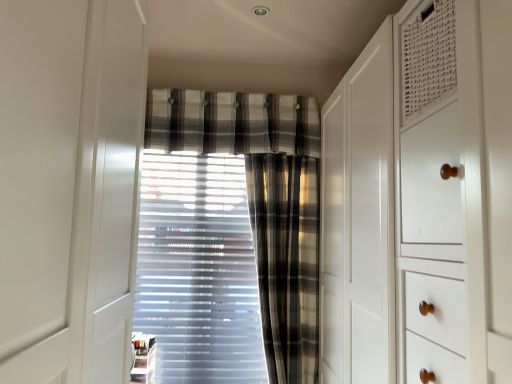
Question: Considering the positions of plaid fabric at center and plaid fabric curtain at center, which is the first curtain in left-to-right order, in the image, is plaid fabric at center bigger or smaller than plaid fabric curtain at center, which is the first curtain in left-to-right order,?

Choices:
 (A) big
 (B) small

Answer: (B)

Question: From their relative heights in the image, would you say plaid fabric at center is taller or shorter than plaid fabric curtain at center, arranged as the 2th curtain when viewed from the right?

Choices:
 (A) short
 (B) tall

Answer: (A)

Question: Which is nearer to the plaid fabric curtain at center, arranged as the 2th curtain when viewed from the right?

Choices:
 (A) plaid fabric curtain at center, which is counted as the first curtain, starting from the right
 (B) plaid fabric at center

Answer: (A)

Question: Estimate the real-world distances between objects in this image. Which object is closer to the plaid fabric curtain at center, which is the first curtain in left-to-right order?

Choices:
 (A) plaid fabric curtain at center, which is counted as the first curtain, starting from the right
 (B) plaid fabric at center

Answer: (A)